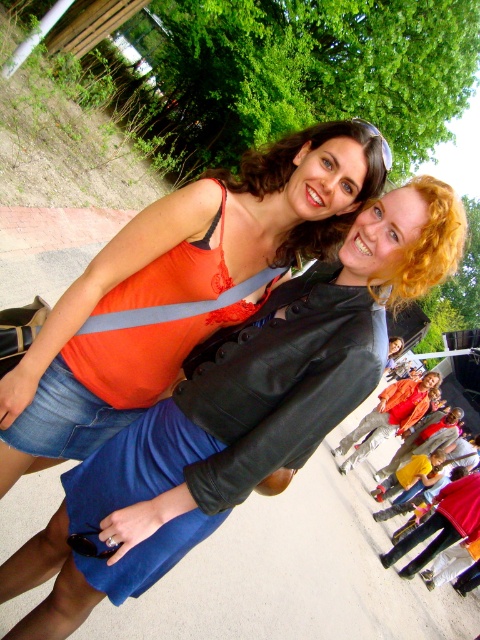
Question: Considering the real-world distances, which object is closest to the black plastic goggles at lower center?

Choices:
 (A) matte orange tank top at center
 (B) clear plastic goggles at upper center

Answer: (A)

Question: Which object is the farthest from the black plastic goggles at lower center?

Choices:
 (A) matte orange tank top at center
 (B) clear plastic goggles at upper center

Answer: (B)

Question: Is matte orange tank top at center smaller than clear plastic goggles at upper center?

Choices:
 (A) yes
 (B) no

Answer: (B)

Question: Which point is farther to the camera?

Choices:
 (A) clear plastic goggles at upper center
 (B) matte orange tank top at center
 (C) red fabric jacket at lower right
 (D) black plastic goggles at lower center

Answer: (C)

Question: Can you confirm if matte orange tank top at center is positioned above black plastic goggles at lower center?

Choices:
 (A) yes
 (B) no

Answer: (A)

Question: Can you confirm if matte orange tank top at center is positioned to the right of clear plastic goggles at upper center?

Choices:
 (A) no
 (B) yes

Answer: (A)